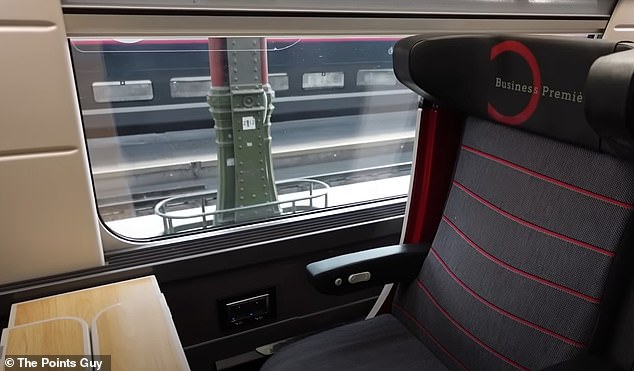
The image size is (634, 371). I want to click on electrical plugs, so click(x=246, y=310).